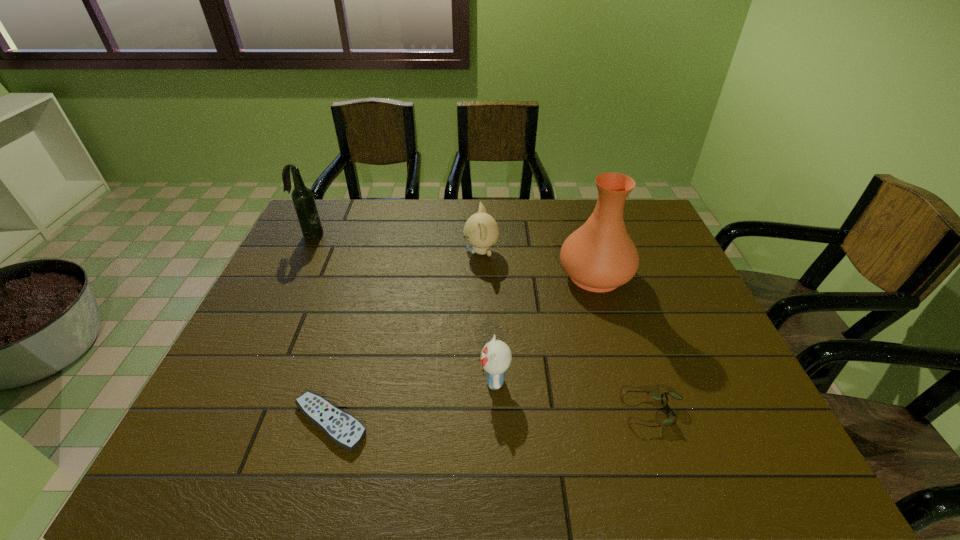
The image size is (960, 540). In the image, there is a desktop. Find the location of `vacant area at the right edge`. vacant area at the right edge is located at coordinates point(689,335).

The width and height of the screenshot is (960, 540). What are the coordinates of `vacant region at the far left corner of the desktop` in the screenshot? It's located at click(x=342, y=212).

This screenshot has width=960, height=540. In the image, there is a desktop. In order to click on vacant space at the far right corner in this screenshot , I will do `click(636, 202)`.

Image resolution: width=960 pixels, height=540 pixels. Identify the location of empty space that is in between the shortest object and the farther kitten. (405, 337).

Locate an element on the screen. vacant space in between the nearer kitten and the spectacles is located at coordinates (574, 396).

Where is `empty space between the farther kitten and the beer bottle`? The height and width of the screenshot is (540, 960). empty space between the farther kitten and the beer bottle is located at coordinates (396, 243).

You are a GUI agent. You are given a task and a screenshot of the screen. Output one action in this format:
    pyautogui.click(x=<x>, y=<y>)
    Task: Click on the free space between the second shortest object and the shorter kitten
    Image resolution: width=960 pixels, height=540 pixels.
    Given the screenshot: What is the action you would take?
    pyautogui.click(x=574, y=396)

You are a GUI agent. You are given a task and a screenshot of the screen. Output one action in this format:
    pyautogui.click(x=<x>, y=<y>)
    Task: Click on the unoccupied area between the shortest object and the spectacles
    This screenshot has height=540, width=960.
    Given the screenshot: What is the action you would take?
    pyautogui.click(x=492, y=417)

You are a GUI agent. You are given a task and a screenshot of the screen. Output one action in this format:
    pyautogui.click(x=<x>, y=<y>)
    Task: Click on the empty space between the farther kitten and the fifth object from right to left
    
    Given the screenshot: What is the action you would take?
    tap(405, 337)

At what (x,y) coordinates should I click in order to perform the action: click on blank region between the nearer kitten and the vase. Please return your answer as a coordinate pair (x, y). This screenshot has width=960, height=540. Looking at the image, I should click on (544, 327).